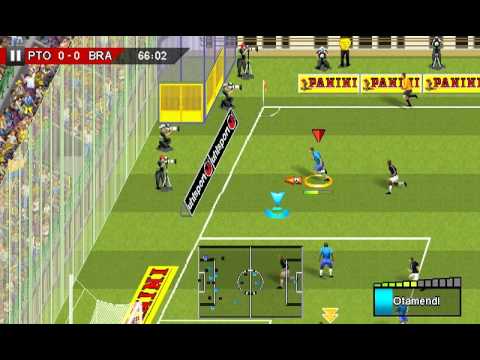
At what (x,y) coordinates should I click in order to perform the action: click on door. Please return your answer as a coordinate pair (x, y). The image size is (480, 360). Looking at the image, I should click on (188, 123).